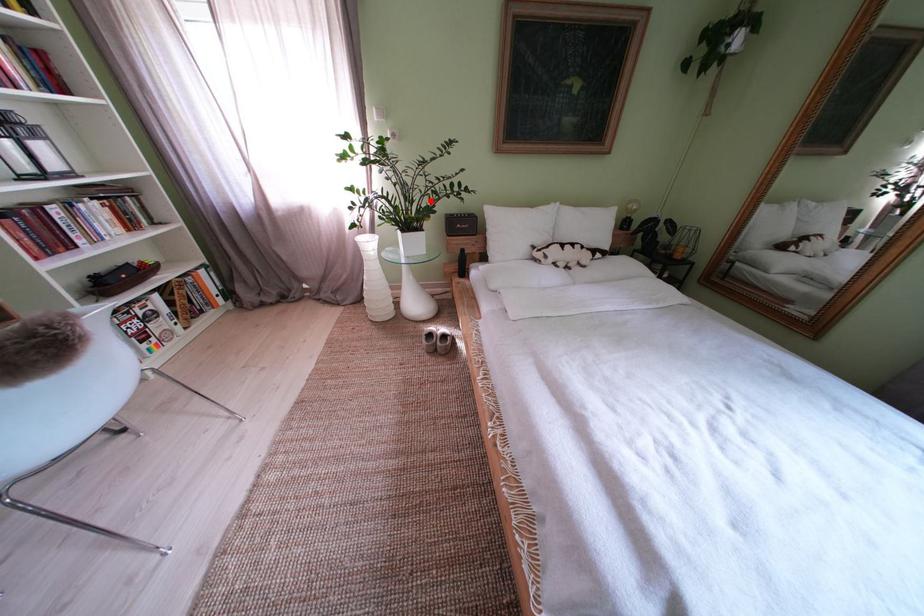
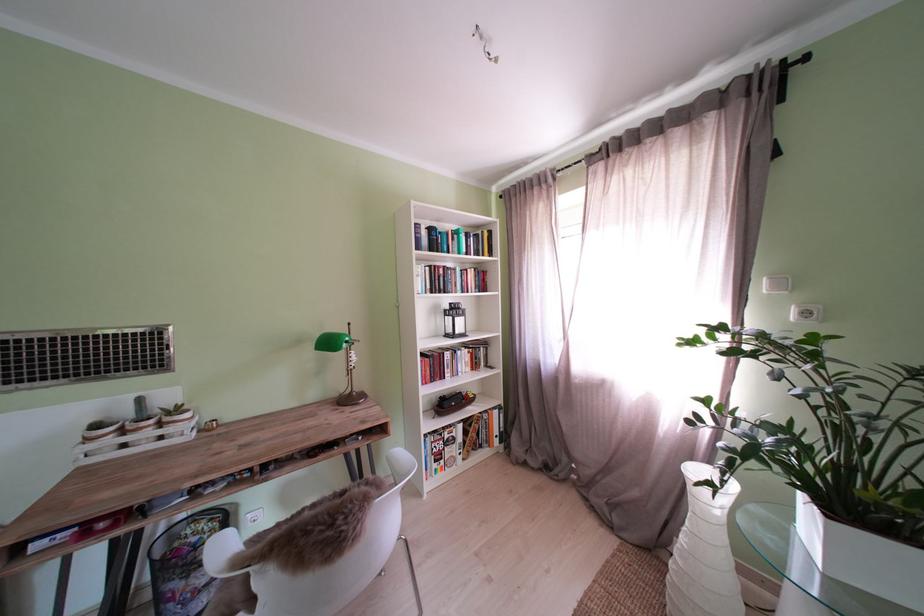
Where in the second image is the point corresponding to the highlighted location from the first image?

(909, 446)